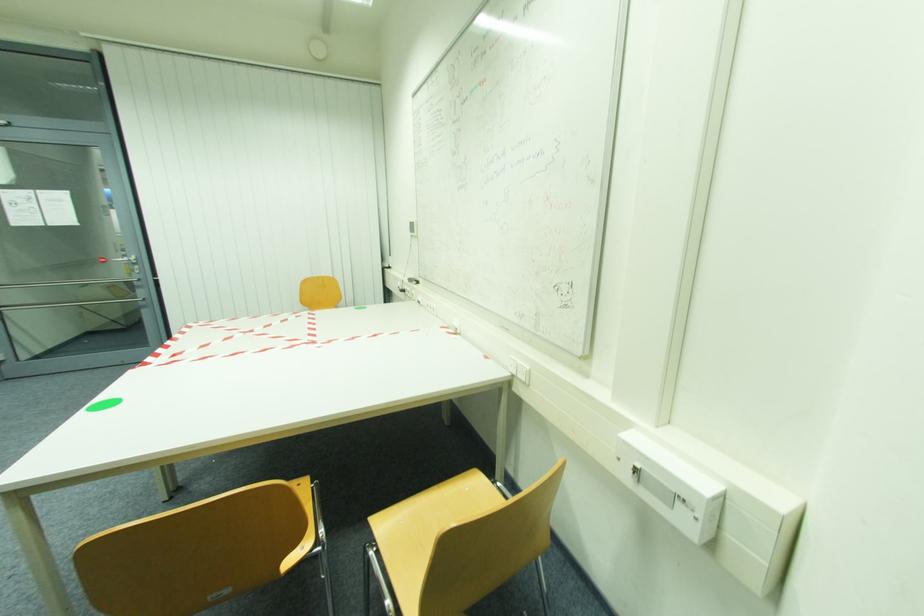
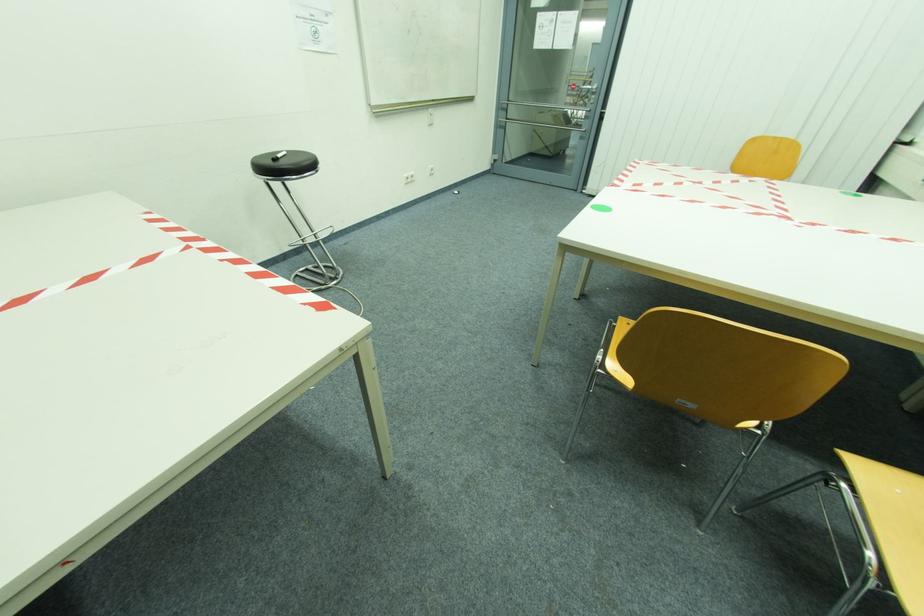
The first image is from the beginning of the video and the second image is from the end. How did the camera likely rotate when shooting the video?

The rotation direction of the camera is left-down.